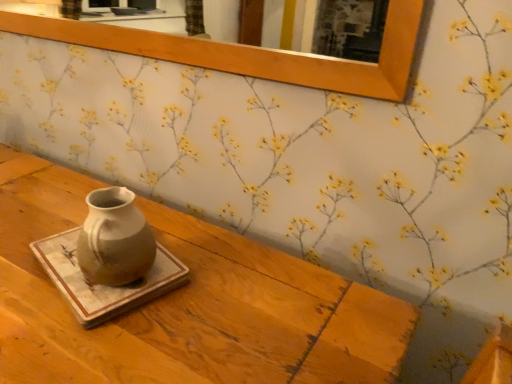
Question: Is wooden frame at upper center to the right of marble tray at center from the viewer's perspective?

Choices:
 (A) yes
 (B) no

Answer: (B)

Question: Is wooden frame at upper center wider than marble tray at center?

Choices:
 (A) yes
 (B) no

Answer: (B)

Question: Considering the relative sizes of wooden frame at upper center and marble tray at center in the image provided, is wooden frame at upper center shorter than marble tray at center?

Choices:
 (A) yes
 (B) no

Answer: (B)

Question: Can you confirm if wooden frame at upper center is smaller than marble tray at center?

Choices:
 (A) yes
 (B) no

Answer: (B)

Question: From the image's perspective, does wooden frame at upper center appear higher than marble tray at center?

Choices:
 (A) no
 (B) yes

Answer: (B)

Question: Is marble tray at center inside or outside of matte ceramic vase at center?

Choices:
 (A) outside
 (B) inside

Answer: (A)

Question: Considering their positions, is marble tray at center located in front of or behind matte ceramic vase at center?

Choices:
 (A) behind
 (B) front

Answer: (A)

Question: From a real-world perspective, is marble tray at center positioned above or below matte ceramic vase at center?

Choices:
 (A) above
 (B) below

Answer: (A)

Question: In terms of size, does marble tray at center appear bigger or smaller than matte ceramic vase at center?

Choices:
 (A) big
 (B) small

Answer: (B)

Question: Is marble tray at center to the left or to the right of wooden frame at upper center in the image?

Choices:
 (A) left
 (B) right

Answer: (B)

Question: Is marble tray at center inside or outside of wooden frame at upper center?

Choices:
 (A) outside
 (B) inside

Answer: (A)

Question: From a real-world perspective, is marble tray at center positioned above or below wooden frame at upper center?

Choices:
 (A) below
 (B) above

Answer: (A)

Question: Is marble tray at center wider or thinner than wooden frame at upper center?

Choices:
 (A) wide
 (B) thin

Answer: (A)

Question: From a real-world perspective, relative to marble tray at center, is wooden frame at upper center vertically above or below?

Choices:
 (A) above
 (B) below

Answer: (A)

Question: Is wooden frame at upper center in front of or behind marble tray at center in the image?

Choices:
 (A) behind
 (B) front

Answer: (A)